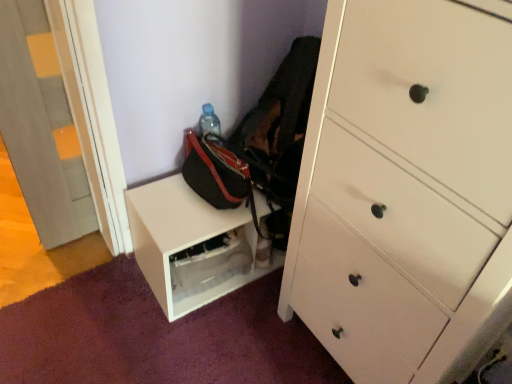
Image resolution: width=512 pixels, height=384 pixels. I want to click on white matte shelf at lower center, so click(191, 245).

Image resolution: width=512 pixels, height=384 pixels. Describe the element at coordinates (41, 127) in the screenshot. I see `matte gray door at left` at that location.

Identify the location of white wood chest of drawers at right. (406, 190).

Locate an element on the screen. The width and height of the screenshot is (512, 384). black fabric messenger bag at lower center is located at coordinates (218, 175).

Where is `white matte shelf at lower center`? The image size is (512, 384). white matte shelf at lower center is located at coordinates (191, 245).

In the scene shown: Considering the relative sizes of matte gray door at left and white matte shelf at lower center in the image provided, is matte gray door at left bigger than white matte shelf at lower center?

No.

Is matte gray door at left looking in the opposite direction of white matte shelf at lower center?

matte gray door at left does not have its back to white matte shelf at lower center.

Who is shorter, matte gray door at left or white matte shelf at lower center?

white matte shelf at lower center.

Considering the relative positions of matte gray door at left and white matte shelf at lower center in the image provided, is matte gray door at left to the left or to the right of white matte shelf at lower center?

Clearly, matte gray door at left is on the left of white matte shelf at lower center in the image.

Considering the points (244, 188) and (168, 231), which point is in front, point (244, 188) or point (168, 231)?

The point (168, 231) is in front.

Could you tell me if black fabric messenger bag at lower center is turned towards white matte shelf at lower center?

No.

From their relative heights in the image, would you say black fabric messenger bag at lower center is taller or shorter than white matte shelf at lower center?

black fabric messenger bag at lower center is shorter than white matte shelf at lower center.

Are black fabric messenger bag at lower center and white matte shelf at lower center far apart?

No, there isn't a large distance between black fabric messenger bag at lower center and white matte shelf at lower center.

Locate an element on the screen. The width and height of the screenshot is (512, 384). door that appears below the white wood chest of drawers at right (from a real-world perspective) is located at coordinates (41, 127).

Which point is more forward, (53, 84) or (503, 312)?

The point (503, 312) is closer.

Is white wood chest of drawers at right completely or partially inside matte gray door at left?

Definitely not — white wood chest of drawers at right is not inside matte gray door at left.

Between black fabric messenger bag at lower center and matte gray door at left, which one has smaller size?

matte gray door at left is smaller.

Is black fabric messenger bag at lower center taller or shorter than matte gray door at left?

In the image, black fabric messenger bag at lower center appears to be shorter than matte gray door at left.

Measure the distance from black fabric messenger bag at lower center to matte gray door at left.

black fabric messenger bag at lower center is 19.61 inches from matte gray door at left.

Which is nearer, (x=202, y=138) or (x=30, y=42)?

Point (x=202, y=138) is positioned farther from the camera compared to point (x=30, y=42).

Can you confirm if white wood chest of drawers at right is positioned to the right of matte gray door at left?

Correct, you'll find white wood chest of drawers at right to the right of matte gray door at left.

Can matte gray door at left be found inside white wood chest of drawers at right?

No, matte gray door at left is not a part of white wood chest of drawers at right.

Measure the distance from white wood chest of drawers at right to matte gray door at left.

white wood chest of drawers at right and matte gray door at left are 37.79 inches apart from each other.

Can you confirm if white matte shelf at lower center is smaller than black fabric messenger bag at lower center?

Yes, white matte shelf at lower center is smaller than black fabric messenger bag at lower center.

How far apart are white matte shelf at lower center and black fabric messenger bag at lower center?

white matte shelf at lower center and black fabric messenger bag at lower center are 5.54 inches apart.

Do you think white matte shelf at lower center is within black fabric messenger bag at lower center, or outside of it?

The correct answer is: outside.

Is white matte shelf at lower center oriented away from black fabric messenger bag at lower center?

No.

Would you say white matte shelf at lower center contains matte gray door at left?

No, matte gray door at left is not a part of white matte shelf at lower center.

In the scene shown: Is white matte shelf at lower center wider or thinner than matte gray door at left?

Clearly, white matte shelf at lower center has more width compared to matte gray door at left.

Which of these two, white matte shelf at lower center or matte gray door at left, is bigger?

white matte shelf at lower center is bigger.

From a real-world perspective, who is located higher, white matte shelf at lower center or matte gray door at left?

From a 3D spatial view, matte gray door at left is above.

At what (x,y) coordinates should I click in order to perform the action: click on furniture that is under the matte gray door at left (from a real-world perspective). Please return your answer as a coordinate pair (x, y). This screenshot has height=384, width=512. Looking at the image, I should click on [191, 245].

Locate an element on the screen. This screenshot has width=512, height=384. furniture below the black fabric messenger bag at lower center (from the image's perspective) is located at coordinates (191, 245).

Which object lies nearer to the anchor point white matte shelf at lower center, white wood chest of drawers at right or black fabric messenger bag at lower center?

Based on the image, black fabric messenger bag at lower center appears to be nearer to white matte shelf at lower center.

From the image, which object appears to be nearer to matte gray door at left, white matte shelf at lower center or black fabric messenger bag at lower center?

white matte shelf at lower center is closer to matte gray door at left.

From the image, which object appears to be nearer to white matte shelf at lower center, matte gray door at left or black fabric messenger bag at lower center?

Based on the image, black fabric messenger bag at lower center appears to be nearer to white matte shelf at lower center.

From the image, which object appears to be nearer to black fabric messenger bag at lower center, matte gray door at left or white wood chest of drawers at right?

Among the two, white wood chest of drawers at right is located nearer to black fabric messenger bag at lower center.

Based on their spatial positions, is matte gray door at left or white wood chest of drawers at right closer to white matte shelf at lower center?

The object closer to white matte shelf at lower center is white wood chest of drawers at right.

Estimate the real-world distances between objects in this image. Which object is closer to white matte shelf at lower center, black fabric messenger bag at lower center or matte gray door at left?

The object closer to white matte shelf at lower center is black fabric messenger bag at lower center.

Based on their spatial positions, is white wood chest of drawers at right or matte gray door at left further from black fabric messenger bag at lower center?

matte gray door at left.

Estimate the real-world distances between objects in this image. Which object is closer to matte gray door at left, black fabric messenger bag at lower center or white matte shelf at lower center?

white matte shelf at lower center is positioned closer to the anchor matte gray door at left.

Locate an element on the screen. messenger bag between white wood chest of drawers at right and white matte shelf at lower center from front to back is located at coordinates 218,175.

At what (x,y) coordinates should I click in order to perform the action: click on furniture between matte gray door at left and black fabric messenger bag at lower center in the horizontal direction. Please return your answer as a coordinate pair (x, y). The height and width of the screenshot is (384, 512). Looking at the image, I should click on (191, 245).

At what (x,y) coordinates should I click in order to perform the action: click on messenger bag situated between matte gray door at left and white wood chest of drawers at right from left to right. Please return your answer as a coordinate pair (x, y). This screenshot has height=384, width=512. Looking at the image, I should click on (218, 175).

Locate an element on the screen. Image resolution: width=512 pixels, height=384 pixels. furniture between matte gray door at left and white wood chest of drawers at right from left to right is located at coordinates (191, 245).